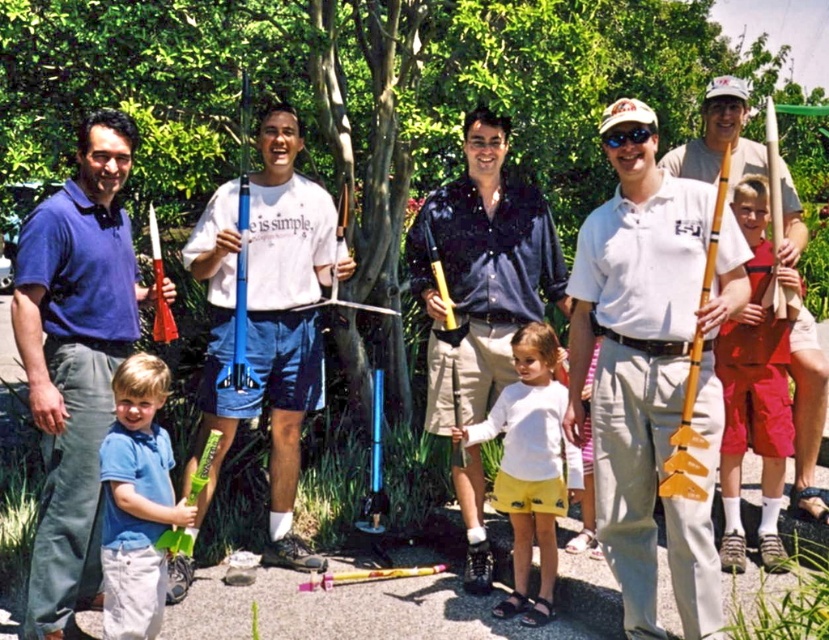
Question: Which point is closer to the camera?

Choices:
 (A) (742, 241)
 (B) (483, 376)
 (C) (527, 492)

Answer: (A)

Question: Can you confirm if matte white polo shirt at center is bigger than white matte shirt at center?

Choices:
 (A) yes
 (B) no

Answer: (A)

Question: Which is farther from the shiny blue shirt at center?

Choices:
 (A) white matte shirt at center
 (B) blue matte rocket at lower left
 (C) matte yellow rocket at right
 (D) blue cotton shirt at left

Answer: (D)

Question: Observing the image, what is the correct spatial positioning of blue cotton shirt at left in reference to white matte shirt at center?

Choices:
 (A) left
 (B) right

Answer: (A)

Question: Where is matte white polo shirt at center located in relation to matte yellow rocket at right in the image?

Choices:
 (A) left
 (B) right

Answer: (A)

Question: Which of these objects is positioned farthest from the matte white polo shirt at center?

Choices:
 (A) white matte shirt at center
 (B) red cotton shorts at right
 (C) shiny blue shirt at center
 (D) matte yellow rocket at right

Answer: (D)